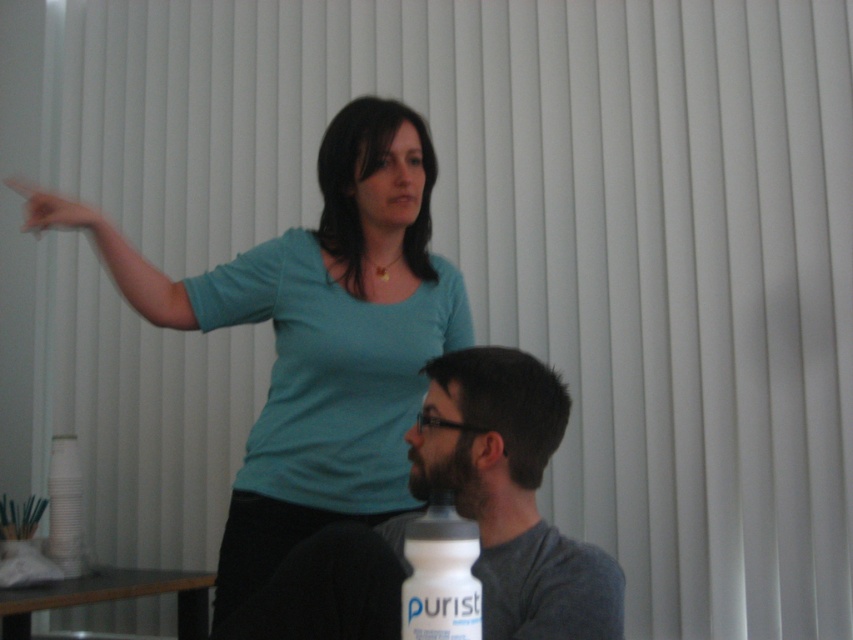
You are a tailor measuring the distance between two shirts in a display. The shirts are the teal matte shirt at upper center and the gray matte shirt at lower center. The minimum space required between displayed items is 20 inches. Can you confirm if the current spacing meets the requirement?

The teal matte shirt at upper center and gray matte shirt at lower center are 21.10 inches apart from each other, which exceeds the minimum 20 inches requirement. Therefore, the current spacing meets the requirement.

You are a photographer trying to capture a clear shot of the gray matte shirt at lower center and the matte skin hand at upper left. Since you want both subjects to be in focus, which one should you adjust your camera focus to prioritize? Please explain your reasoning based on their positions.

The gray matte shirt at lower center is in front of the matte skin hand at upper left. To have both in focus, prioritize focusing on the gray matte shirt at lower center since it is closer to the camera. This ensures the foreground subject is sharp, and the background hand may still be in acceptable focus depending on the depth of field.

You are a tailor measuring for a sleeve length. You have a tape measure and need to compare the width of the gray matte shirt at lower center and the matte skin hand at upper left. Which one is wider?

The gray matte shirt at lower center is wider than the matte skin hand at upper left according to the description.